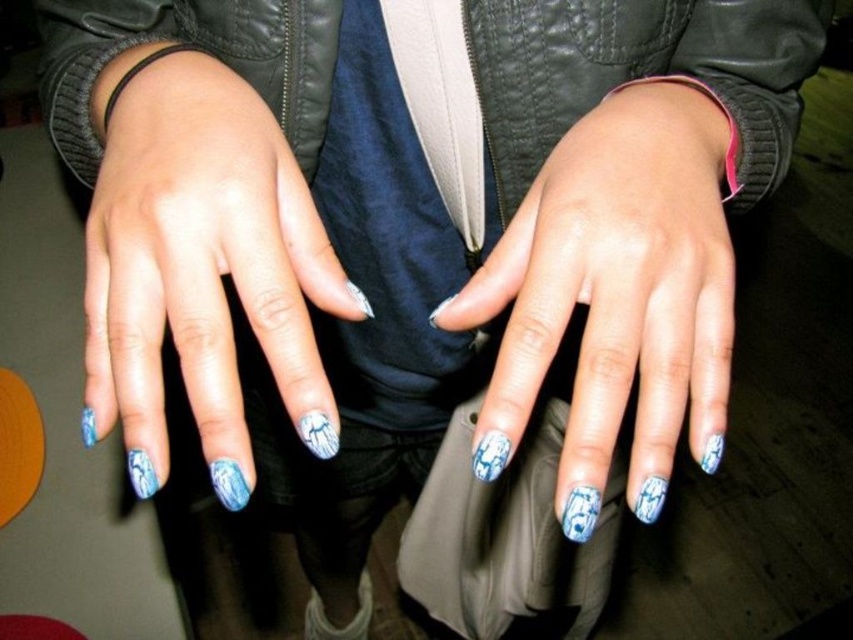
Question: Which point is closer to the camera?

Choices:
 (A) (119, 56)
 (B) (538, 198)

Answer: (B)

Question: Is blue marble nails at center behind blue painted nails at center?

Choices:
 (A) yes
 (B) no

Answer: (B)

Question: Among these points, which one is farthest from the camera?

Choices:
 (A) (602, 284)
 (B) (160, 164)

Answer: (B)

Question: Does blue marble nails at center appear on the right side of blue painted nails at center?

Choices:
 (A) yes
 (B) no

Answer: (B)

Question: Can you confirm if blue marble nails at center is positioned to the right of blue painted nails at center?

Choices:
 (A) yes
 (B) no

Answer: (B)